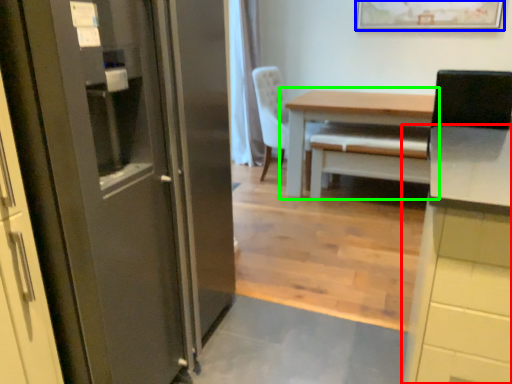
Question: Which is farther away from cabinetry (highlighted by a red box)? picture frame (highlighted by a blue box) or table (highlighted by a green box)?

Choices:
 (A) picture frame
 (B) table

Answer: (A)